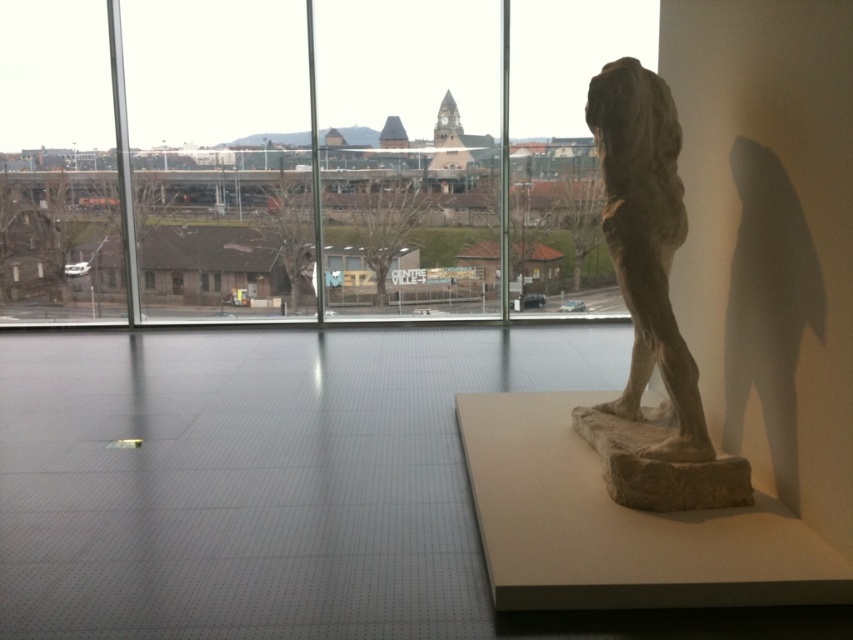
Which is behind, point (364, 300) or point (660, 113)?

Point (364, 300)

Between transparent glass window at center and stone statue at right, which one appears on the left side from the viewer's perspective?

Positioned to the left is transparent glass window at center.

Between point (122, 234) and point (625, 417), which one is positioned behind?

Point (122, 234)

The height and width of the screenshot is (640, 853). What are the coordinates of `transparent glass window at center` in the screenshot? It's located at (305, 160).